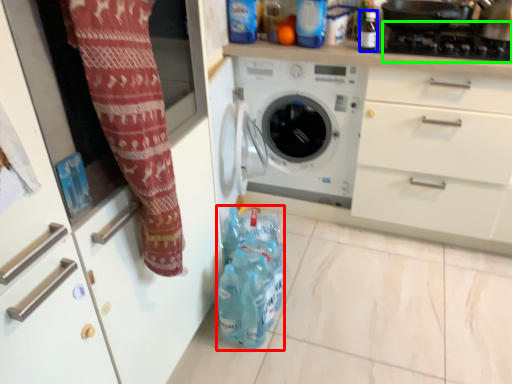
Question: Considering the real-world distances, which object is closest to bottle (highlighted by a red box)? bottle (highlighted by a blue box) or gas stove (highlighted by a green box).

Choices:
 (A) bottle
 (B) gas stove

Answer: (A)